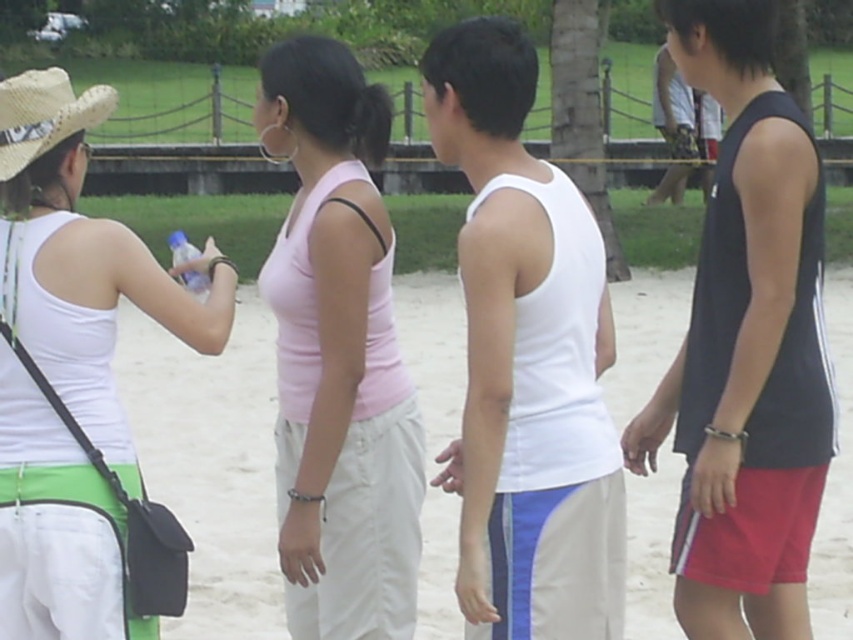
Based on the provided scene description, where is the pink fabric tank top at center located in relation to the other individuals?

The pink fabric tank top at center is located at the center position among the three foreground individuals, positioned at coordinates point (x=338, y=355).

Based on the scene description, which person is wearing the white matte tank top at center and how does their clothing compare in width to the person in the black matte tank top at right?

The person wearing the white matte tank top at center has a thinner build compared to the person in the black matte tank top at right, as the white matte tank top at center is thinner than the black matte tank top at right.

You are standing on a sandy beach and see two people in front of you. One is wearing a white matte tank top at center and the other a black matte tank top at right. Which one is positioned to the left?

The white matte tank top at center is positioned to the left of the black matte tank top at right.